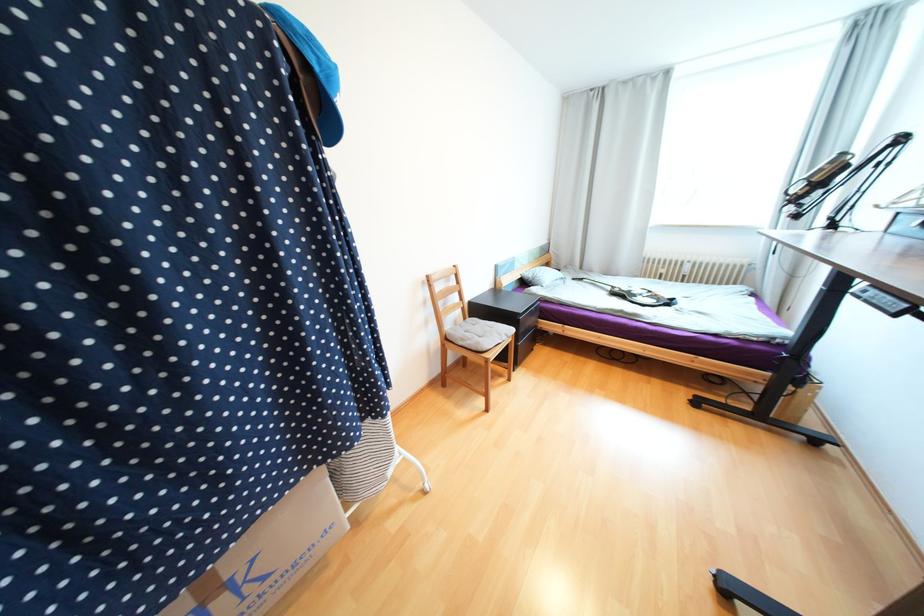
At what (x,y) coordinates should I click in order to perform the action: click on cardboard box. Please return your answer as a coordinate pair (x, y). Image resolution: width=924 pixels, height=616 pixels. Looking at the image, I should click on point(269,554).